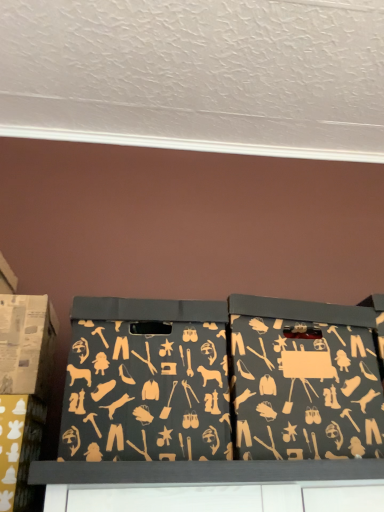
Question: Considering the relative positions of matte cardboard box at left, positioned as the 1th box in left-to-right order, and matte black box at center, the first box when ordered from right to left, in the image provided, is matte cardboard box at left, positioned as the 1th box in left-to-right order, in front of matte black box at center, the first box when ordered from right to left,?

Choices:
 (A) yes
 (B) no

Answer: (B)

Question: Considering the relative positions of matte cardboard box at left, positioned as the 1th box in left-to-right order, and matte black box at center, the first box when ordered from right to left, in the image provided, is matte cardboard box at left, positioned as the 1th box in left-to-right order, to the left of matte black box at center, the first box when ordered from right to left, from the viewer's perspective?

Choices:
 (A) no
 (B) yes

Answer: (B)

Question: From the image's perspective, is matte cardboard box at left, which appears as the fourth box when viewed from the right, under matte black box at center, positioned as the fourth box in left-to-right order?

Choices:
 (A) yes
 (B) no

Answer: (B)

Question: Is matte cardboard box at left, positioned as the 1th box in left-to-right order, facing away from matte black box at center, the first box when ordered from right to left?

Choices:
 (A) no
 (B) yes

Answer: (A)

Question: Considering the relative sizes of matte cardboard box at left, which appears as the fourth box when viewed from the right, and matte black box at center, positioned as the fourth box in left-to-right order, in the image provided, is matte cardboard box at left, which appears as the fourth box when viewed from the right, thinner than matte black box at center, positioned as the fourth box in left-to-right order,?

Choices:
 (A) no
 (B) yes

Answer: (B)

Question: Is matte cardboard box at left, positioned as the 1th box in left-to-right order, to the left or to the right of matte black storage box at center, the second box viewed from the right, in the image?

Choices:
 (A) right
 (B) left

Answer: (B)

Question: From the image's perspective, is matte cardboard box at left, positioned as the 1th box in left-to-right order, positioned above or below matte black storage box at center, the second box viewed from the right?

Choices:
 (A) above
 (B) below

Answer: (A)

Question: Is matte cardboard box at left, positioned as the 1th box in left-to-right order, bigger or smaller than matte black storage box at center, the third box when ordered from left to right?

Choices:
 (A) small
 (B) big

Answer: (A)

Question: Do you think matte cardboard box at left, which appears as the fourth box when viewed from the right, is within matte black storage box at center, the third box when ordered from left to right, or outside of it?

Choices:
 (A) outside
 (B) inside

Answer: (A)

Question: Considering the positions of matte cardboard box at left, positioned as the 1th box in left-to-right order, and matte black storage bin at lower left, the 3th box viewed from the right, in the image, is matte cardboard box at left, positioned as the 1th box in left-to-right order, wider or thinner than matte black storage bin at lower left, the 3th box viewed from the right,?

Choices:
 (A) wide
 (B) thin

Answer: (B)

Question: Which is correct: matte cardboard box at left, which appears as the fourth box when viewed from the right, is inside matte black storage bin at lower left, the 3th box viewed from the right, or outside of it?

Choices:
 (A) inside
 (B) outside

Answer: (B)

Question: Considering the positions of matte cardboard box at left, which appears as the fourth box when viewed from the right, and matte black storage bin at lower left, the second box positioned from the left, in the image, is matte cardboard box at left, which appears as the fourth box when viewed from the right, bigger or smaller than matte black storage bin at lower left, the second box positioned from the left,?

Choices:
 (A) big
 (B) small

Answer: (A)

Question: Considering the positions of matte cardboard box at left, which appears as the fourth box when viewed from the right, and matte black storage bin at lower left, the 3th box viewed from the right, in the image, is matte cardboard box at left, which appears as the fourth box when viewed from the right, taller or shorter than matte black storage bin at lower left, the 3th box viewed from the right,?

Choices:
 (A) tall
 (B) short

Answer: (A)

Question: Is point (21, 411) positioned closer to the camera than point (251, 312)?

Choices:
 (A) closer
 (B) farther

Answer: (B)

Question: From the image's perspective, is matte black storage bin at lower left, the second box positioned from the left, located above or below matte black box at center, the first box when ordered from right to left?

Choices:
 (A) above
 (B) below

Answer: (B)